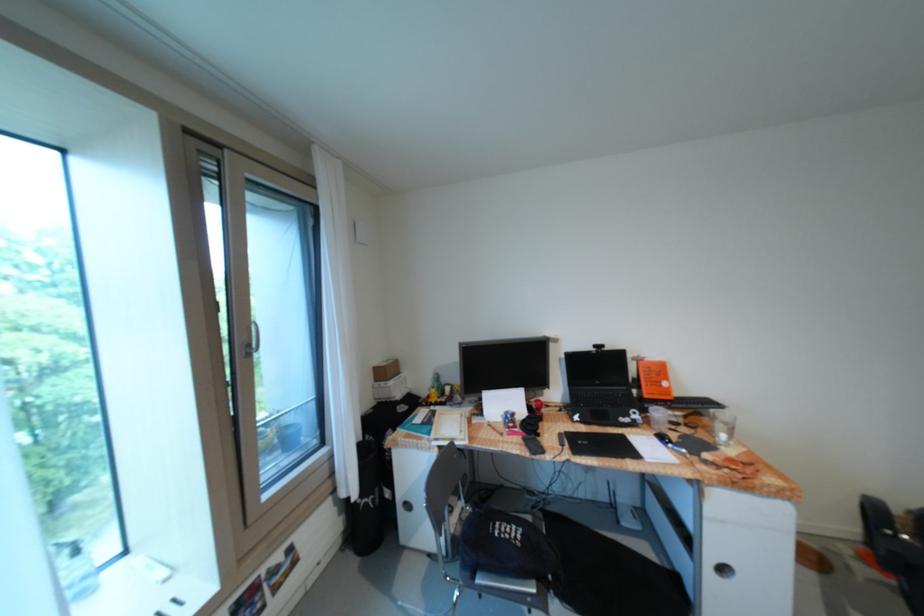
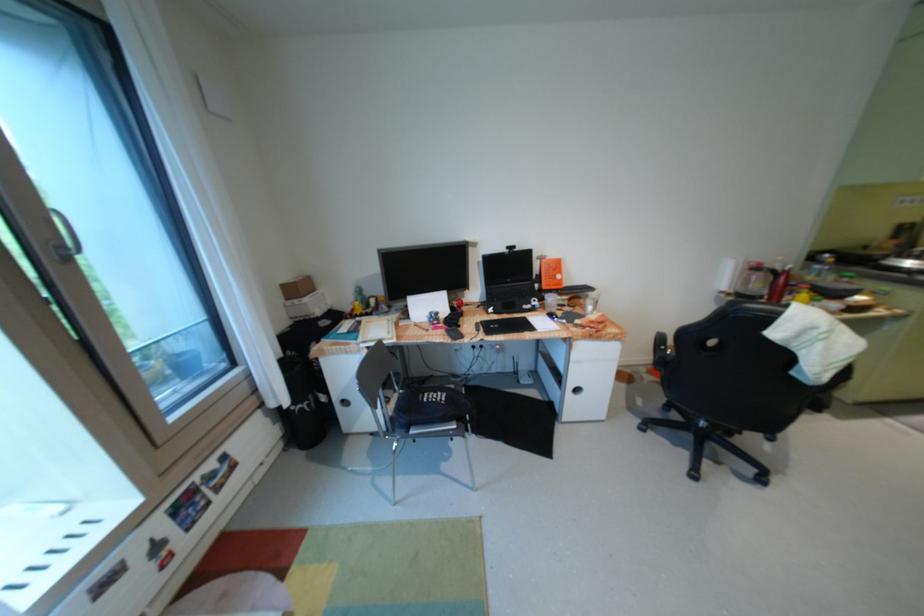
Find the pixel in the second image that matches the point at 658,387 in the first image.

(555, 280)